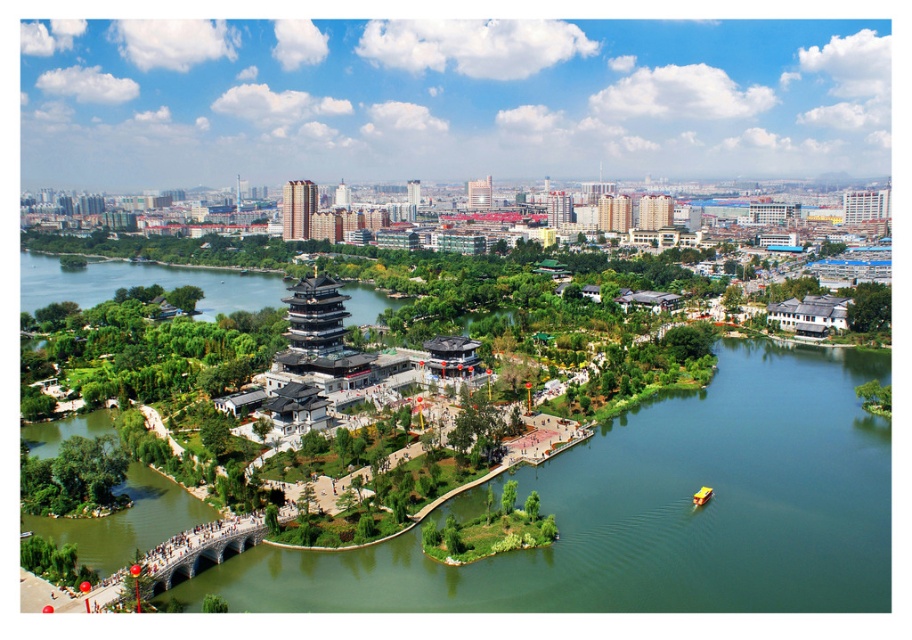
You are an architect designing a new floating platform for the green water at center. The platform must accommodate the yellow plastic boat at lower right. Based on their heights, will the boat be able to pass under the platform without any modifications?

The green water at center has a greater height compared to yellow plastic boat at lower right. Since the platform will be placed on the water, the boat can pass under it as the water itself is higher than the boat, allowing sufficient clearance.